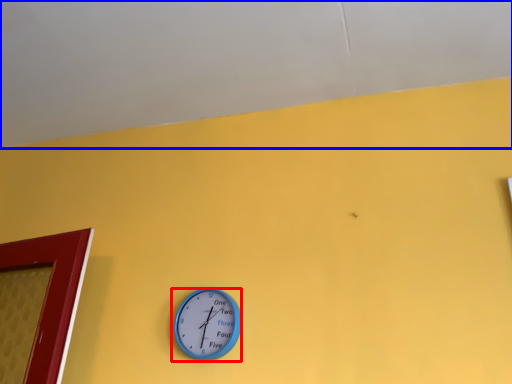
Question: Which point is closer to the camera, wall clock (highlighted by a red box) or backdrop (highlighted by a blue box)?

Choices:
 (A) wall clock
 (B) backdrop

Answer: (B)